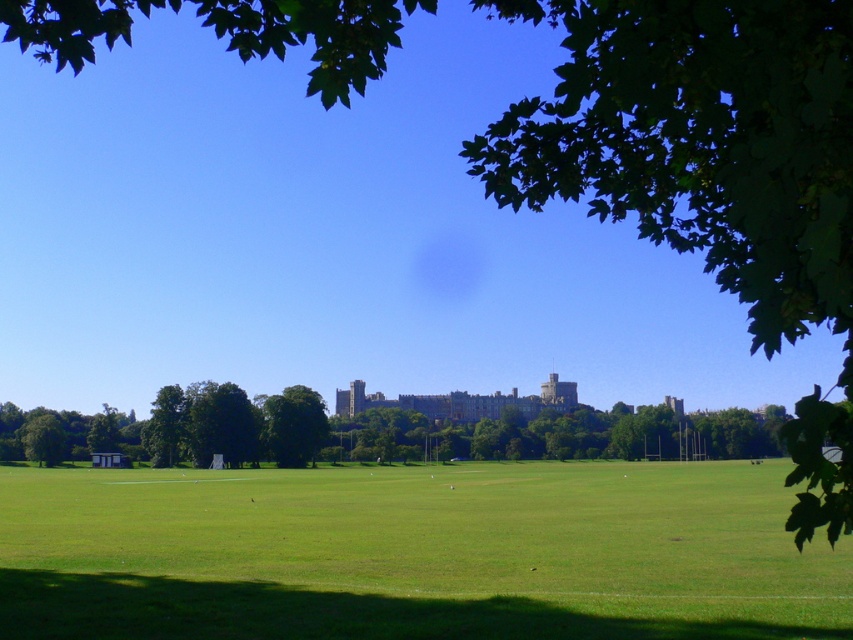
From the picture: You are standing at the edge of the field near the tree branches in the foreground. If you want to reach the green grass field at center, which direction should you move in?

The green grass field at center is located at point 0.866 on the x and 0.487 on the y, so you should move towards the center of the image to reach it.

You are a hiker standing at the edge of the green grass field at center and the green leafy tree at center. You want to take a photo that captures both objects in the frame. Which object should you focus on to ensure both are in the background?

The green grass field at center is taller than the green leafy tree at center. To capture both in the background, focus on the green grass field at center since it is taller and will remain in the background along with the tree.

You are planning to set up a picnic blanket in the green grass field at center. Considering the space available, will the green leafy tree at center provide enough shade for your blanket?

The green grass field at center has a larger width than the green leafy tree at center, so the tree might not provide enough shade to cover the entire picnic blanket placed on the field.